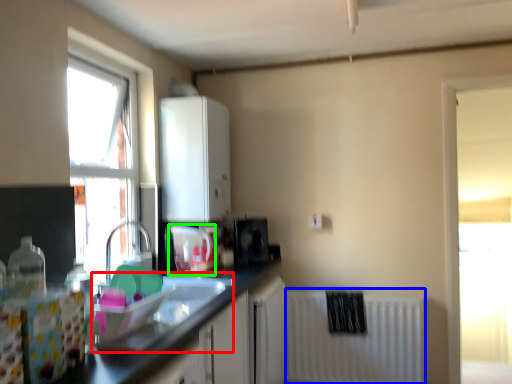
Question: Which object is positioned farthest from sink (highlighted by a red box)? Select from radiator (highlighted by a blue box) and appliance (highlighted by a green box).

Choices:
 (A) radiator
 (B) appliance

Answer: (A)